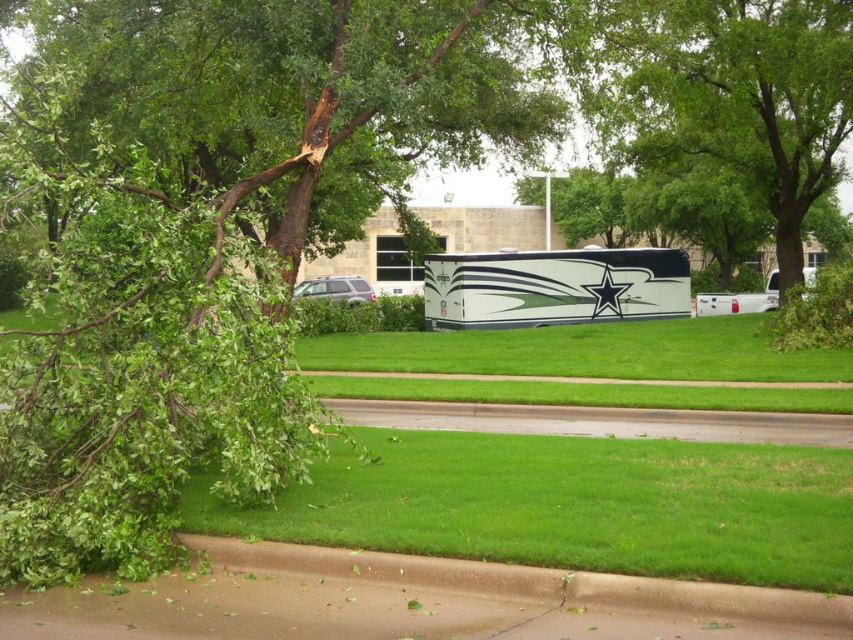
Question: Is green rough bark tree at left above satin silver suv at center?

Choices:
 (A) no
 (B) yes

Answer: (B)

Question: Is green grass at center above satin silver suv at center?

Choices:
 (A) no
 (B) yes

Answer: (A)

Question: Which point is closer to the camera?

Choices:
 (A) (747, 20)
 (B) (596, 259)
 (C) (410, 497)
 (D) (512, 28)

Answer: (C)

Question: Can you confirm if green rough bark tree at left is smaller than satin silver suv at center?

Choices:
 (A) no
 (B) yes

Answer: (A)

Question: Which of the following is the closest to the observer?

Choices:
 (A) (424, 310)
 (B) (486, 388)
 (C) (677, 132)
 (D) (718, 308)

Answer: (B)

Question: Which point is closer to the camera?

Choices:
 (A) (631, 516)
 (B) (315, 244)
 (C) (651, 449)
 (D) (508, 321)

Answer: (A)